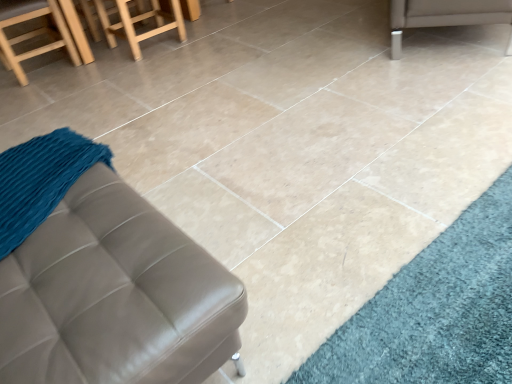
What is the approximate height of leather ottoman at lower left, acting as the 2th furniture starting from the top?

The height of leather ottoman at lower left, acting as the 2th furniture starting from the top, is 30.05 inches.

Where is `wooden stool at upper left`? This screenshot has height=384, width=512. wooden stool at upper left is located at coordinates (32, 32).

From a real-world perspective, between leather ottoman at lower left, acting as the 2th furniture starting from the right, and wooden stool at upper left, who is vertically higher?

From a 3D spatial view, leather ottoman at lower left, acting as the 2th furniture starting from the right, is above.

Does point (77, 258) come closer to viewer compared to point (123, 13)?

Yes, point (77, 258) is in front of point (123, 13).

What's the angular difference between leather ottoman at lower left, placed as the first furniture when sorted from bottom to top, and wooden stool at upper left's facing directions?

The facing directions of leather ottoman at lower left, placed as the first furniture when sorted from bottom to top, and wooden stool at upper left are 89.4 degrees apart.

From a real-world perspective, is wooden stool at upper left above or below wooden stool at upper left?

Clearly, from a real-world perspective, wooden stool at upper left is above wooden stool at upper left.

Which object is thinner, wooden stool at upper left or wooden stool at upper left?

With smaller width is wooden stool at upper left.

Find the location of a particular element. stool behind the wooden stool at upper left is located at coordinates (139, 21).

From the image's perspective, which object appears higher, wooden stool at upper left or wooden stool at upper left?

wooden stool at upper left is shown above in the image.

Can we say silver metallic leg at upper right, the second furniture positioned from the bottom, lies outside leather ottoman at lower left, acting as the 2th furniture starting from the top?

Yes, silver metallic leg at upper right, the second furniture positioned from the bottom, is outside of leather ottoman at lower left, acting as the 2th furniture starting from the top.

From a real-world perspective, is silver metallic leg at upper right, acting as the 1th furniture starting from the top, positioned above or below leather ottoman at lower left, the second furniture positioned from the back?

From a real-world perspective, silver metallic leg at upper right, acting as the 1th furniture starting from the top, is physically below leather ottoman at lower left, the second furniture positioned from the back.

Considering the positions of objects silver metallic leg at upper right, acting as the 1th furniture starting from the back, and leather ottoman at lower left, acting as the 2th furniture starting from the top, in the image provided, who is more to the left, silver metallic leg at upper right, acting as the 1th furniture starting from the back, or leather ottoman at lower left, acting as the 2th furniture starting from the top,?

leather ottoman at lower left, acting as the 2th furniture starting from the top, is more to the left.

Can you tell me how much silver metallic leg at upper right, the 2th furniture when ordered from left to right, and leather ottoman at lower left, the first furniture viewed from the front, differ in facing direction?

There is a 143-degree angle between the facing directions of silver metallic leg at upper right, the 2th furniture when ordered from left to right, and leather ottoman at lower left, the first furniture viewed from the front.

Is leather ottoman at lower left, placed as the first furniture when sorted from bottom to top, wider or thinner than wooden stool at upper left?

Considering their sizes, leather ottoman at lower left, placed as the first furniture when sorted from bottom to top, looks slimmer than wooden stool at upper left.

Measure the distance from leather ottoman at lower left, placed as the first furniture when sorted from bottom to top, to wooden stool at upper left.

A distance of 2.26 meters exists between leather ottoman at lower left, placed as the first furniture when sorted from bottom to top, and wooden stool at upper left.

In the image, is leather ottoman at lower left, placed as the first furniture when sorted from bottom to top, positioned in front of or behind wooden stool at upper left?

leather ottoman at lower left, placed as the first furniture when sorted from bottom to top, is positioned closer to the viewer than wooden stool at upper left.

In the scene shown: Is leather ottoman at lower left, the first furniture viewed from the front, facing towards wooden stool at upper left?

No, leather ottoman at lower left, the first furniture viewed from the front, is not oriented towards wooden stool at upper left.

Is wooden stool at upper left turned away from leather ottoman at lower left, the second furniture positioned from the back?

No, wooden stool at upper left is not facing the opposite direction of leather ottoman at lower left, the second furniture positioned from the back.

Considering the relative positions of wooden stool at upper left and leather ottoman at lower left, the first furniture viewed from the front, in the image provided, is wooden stool at upper left behind leather ottoman at lower left, the first furniture viewed from the front,?

Yes, wooden stool at upper left is further from the viewer.

From a real-world perspective, which is physically below, wooden stool at upper left or leather ottoman at lower left, placed as the 1th furniture when sorted from left to right?

In real-world perspective, wooden stool at upper left is lower.

At what (x,y) coordinates should I click in order to perform the action: click on the 2nd furniture below the wooden stool at upper left (from the image's perspective). Please return your answer as a coordinate pair (x, y). The width and height of the screenshot is (512, 384). Looking at the image, I should click on (114, 295).

Can you confirm if wooden stool at upper left is thinner than silver metallic leg at upper right, marked as the first furniture in a right-to-left arrangement?

Yes, wooden stool at upper left is thinner than silver metallic leg at upper right, marked as the first furniture in a right-to-left arrangement.

From a real-world perspective, is wooden stool at upper left physically located above or below silver metallic leg at upper right, acting as the 1th furniture starting from the top?

Clearly, from a real-world perspective, wooden stool at upper left is above silver metallic leg at upper right, acting as the 1th furniture starting from the top.

Is the depth of wooden stool at upper left greater than that of silver metallic leg at upper right, the second furniture positioned from the bottom?

Yes, it is.

Is wooden stool at upper left not inside silver metallic leg at upper right, acting as the 1th furniture starting from the back?

Yes, wooden stool at upper left is outside of silver metallic leg at upper right, acting as the 1th furniture starting from the back.

Looking at this image, are wooden stool at upper left and leather ottoman at lower left, placed as the first furniture when sorted from bottom to top, located far from each other?

wooden stool at upper left is far away from leather ottoman at lower left, placed as the first furniture when sorted from bottom to top.

Which object is closer to the camera, wooden stool at upper left or leather ottoman at lower left, placed as the 1th furniture when sorted from left to right?

Positioned in front is leather ottoman at lower left, placed as the 1th furniture when sorted from left to right.

Looking at this image, from a real-world perspective, who is located higher, wooden stool at upper left or leather ottoman at lower left, the second furniture positioned from the back?

In real-world perspective, leather ottoman at lower left, the second furniture positioned from the back, is above.

Find the location of a particular element. This screenshot has width=512, height=384. stool behind the leather ottoman at lower left, acting as the 2th furniture starting from the top is located at coordinates (139, 21).

The height and width of the screenshot is (384, 512). Find the location of `chair above the wooden stool at upper left (from a real-world perspective)`. chair above the wooden stool at upper left (from a real-world perspective) is located at coordinates (32, 32).

From the image, which object appears to be farther from silver metallic leg at upper right, the second furniture viewed from the front, wooden stool at upper left or wooden stool at upper left?

The object further to silver metallic leg at upper right, the second furniture viewed from the front, is wooden stool at upper left.

Considering their positions, is leather ottoman at lower left, placed as the 1th furniture when sorted from left to right, positioned closer to silver metallic leg at upper right, the second furniture viewed from the front, than wooden stool at upper left?

wooden stool at upper left.

Based on their spatial positions, is wooden stool at upper left or leather ottoman at lower left, the second furniture positioned from the back, closer to wooden stool at upper left?

wooden stool at upper left lies closer to wooden stool at upper left than the other object.

Looking at the image, which one is located further to silver metallic leg at upper right, the second furniture positioned from the bottom, wooden stool at upper left or leather ottoman at lower left, placed as the 1th furniture when sorted from left to right?

wooden stool at upper left is further to silver metallic leg at upper right, the second furniture positioned from the bottom.

Considering their positions, is wooden stool at upper left positioned further to leather ottoman at lower left, placed as the first furniture when sorted from bottom to top, than wooden stool at upper left?

wooden stool at upper left lies further to leather ottoman at lower left, placed as the first furniture when sorted from bottom to top, than the other object.

When comparing their distances from wooden stool at upper left, does silver metallic leg at upper right, acting as the 1th furniture starting from the back, or wooden stool at upper left seem closer?

The object closer to wooden stool at upper left is wooden stool at upper left.

In the scene shown: Looking at the image, which one is located closer to silver metallic leg at upper right, the second furniture viewed from the front, wooden stool at upper left or wooden stool at upper left?

wooden stool at upper left.

Considering their positions, is wooden stool at upper left positioned further to silver metallic leg at upper right, acting as the 1th furniture starting from the top, than leather ottoman at lower left, acting as the 2th furniture starting from the right?

leather ottoman at lower left, acting as the 2th furniture starting from the right, is positioned further to the anchor silver metallic leg at upper right, acting as the 1th furniture starting from the top.

Locate an element on the screen. The height and width of the screenshot is (384, 512). stool situated between wooden stool at upper left and silver metallic leg at upper right, the 2th furniture when ordered from left to right, from left to right is located at coordinates tap(139, 21).

Where is `furniture between wooden stool at upper left and silver metallic leg at upper right, the second furniture viewed from the front, in the horizontal direction`? The image size is (512, 384). furniture between wooden stool at upper left and silver metallic leg at upper right, the second furniture viewed from the front, in the horizontal direction is located at coordinates (114, 295).

Identify the location of chair positioned between leather ottoman at lower left, acting as the 2th furniture starting from the right, and wooden stool at upper left from near to far. The width and height of the screenshot is (512, 384). (32, 32).

Locate an element on the screen. The height and width of the screenshot is (384, 512). furniture between leather ottoman at lower left, placed as the 1th furniture when sorted from left to right, and wooden stool at upper left in the front-back direction is located at coordinates (444, 15).